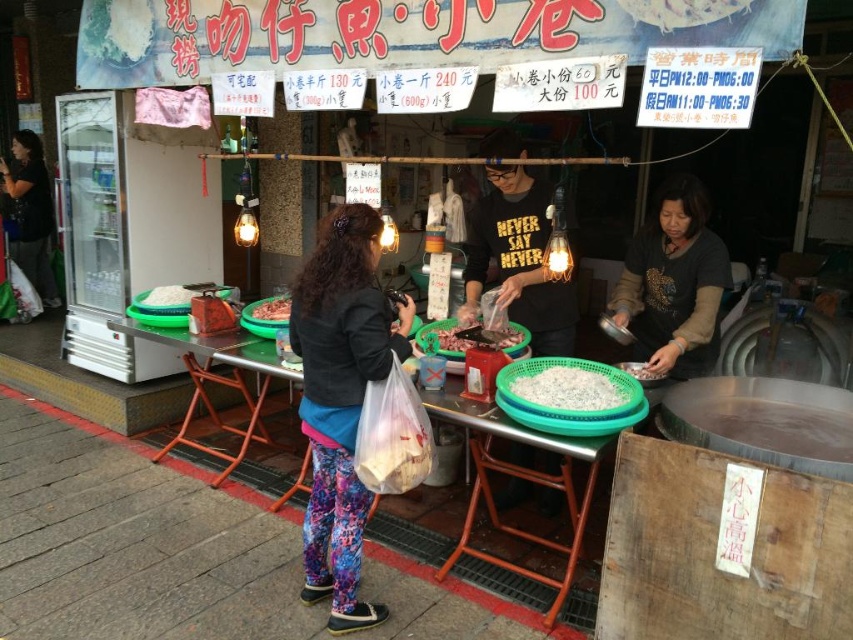
You are a customer at the street food stall and want to place an order. You see the green plastic table at center and the pinkish matte meat at center. Which object is located to the right of the other?

The green plastic table at center is positioned on the right side of pinkish matte meat at center, so the green plastic table at center is to the right of the pinkish matte meat at center.

You are a customer at the street food stall and want to place an order. You have a small plate that can only hold items up to the size of the pinkish matte meat at center. Can you fit an item from the green plastic table at center onto your plate?

The green plastic table at center is wider than the pinkish matte meat at center, so the item from the green plastic table at center may not fit on your small plate designed for items up to the size of the pinkish matte meat at center.